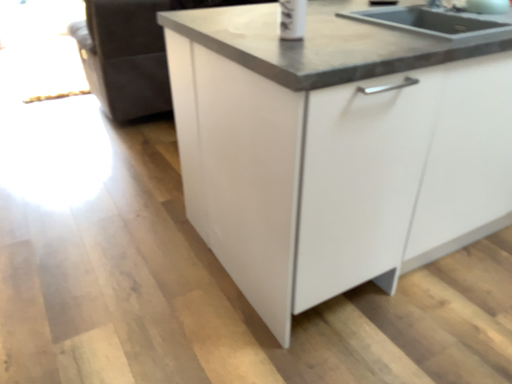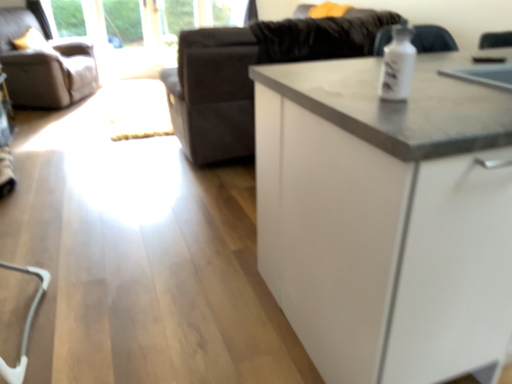
Question: Which way did the camera rotate in the video?

Choices:
 (A) rotated right
 (B) rotated left

Answer: (B)